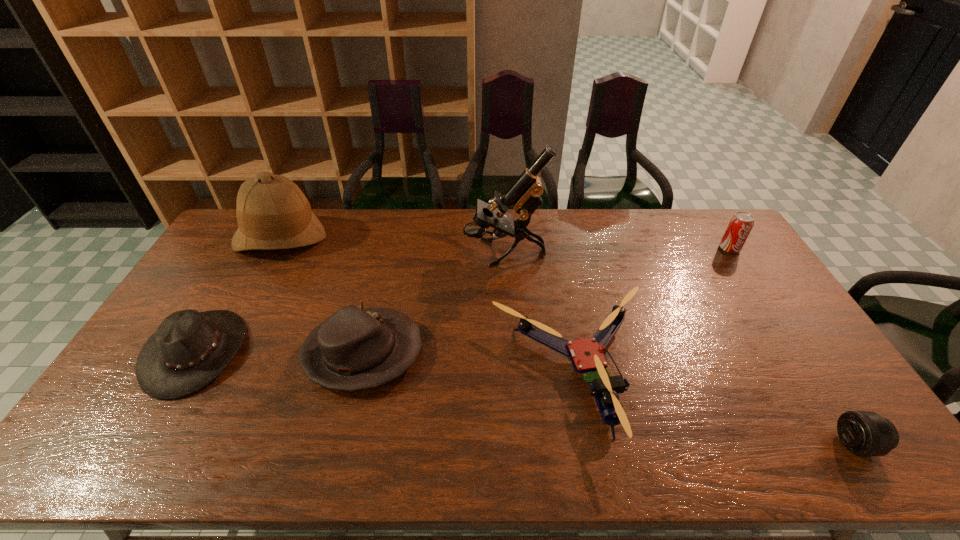
This screenshot has height=540, width=960. I want to click on free spot at the right edge of the desktop, so click(722, 266).

Identify the location of free space at the near right corner. (811, 439).

Find the location of a particular element. The image size is (960, 540). unoccupied position between the fifth object from right to left and the soda can is located at coordinates (546, 301).

At what (x,y) coordinates should I click in order to perform the action: click on vacant space in between the tallest hat and the drone. Please return your answer as a coordinate pair (x, y). The image size is (960, 540). Looking at the image, I should click on pyautogui.click(x=427, y=305).

This screenshot has height=540, width=960. I want to click on vacant point located between the farthest hat and the soda can, so tap(505, 243).

In order to click on unoccupied area between the drone and the soda can in this screenshot , I will do `click(652, 310)`.

At what (x,y) coordinates should I click in order to perform the action: click on free space between the microscope and the drone. Please return your answer as a coordinate pair (x, y). The width and height of the screenshot is (960, 540). Looking at the image, I should click on (540, 312).

Where is `object that is the closest to the tallest object`? object that is the closest to the tallest object is located at coordinates (586, 355).

Where is `the sixth closest object relative to the telephoto lens`? This screenshot has height=540, width=960. the sixth closest object relative to the telephoto lens is located at coordinates (272, 212).

Identify which hat is located as the third nearest to the microscope. Please provide its 2D coordinates. Your answer should be formatted as a tuple, i.e. [(x, y)], where the tuple contains the x and y coordinates of a point satisfying the conditions above.

[(189, 349)]